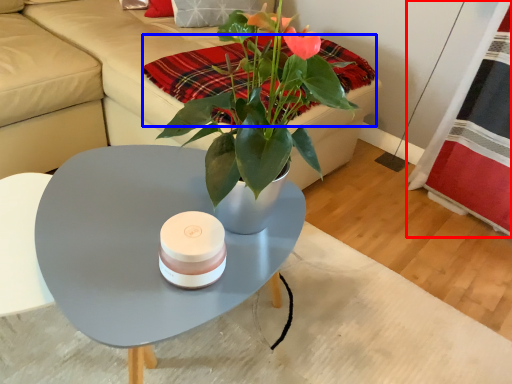
Question: Among these objects, which one is nearest to the camera, plaid (highlighted by a red box) or blanket (highlighted by a blue box)?

Choices:
 (A) plaid
 (B) blanket

Answer: (B)